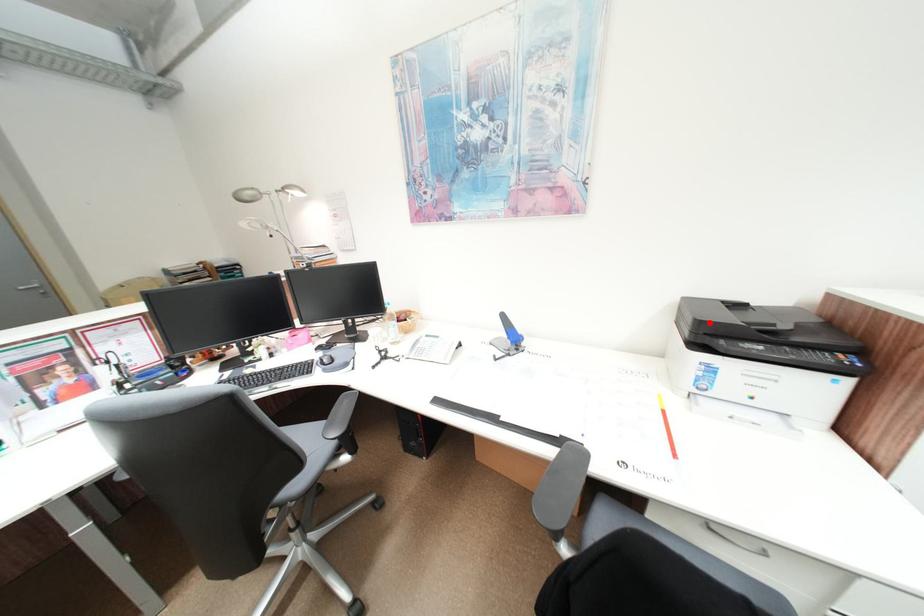
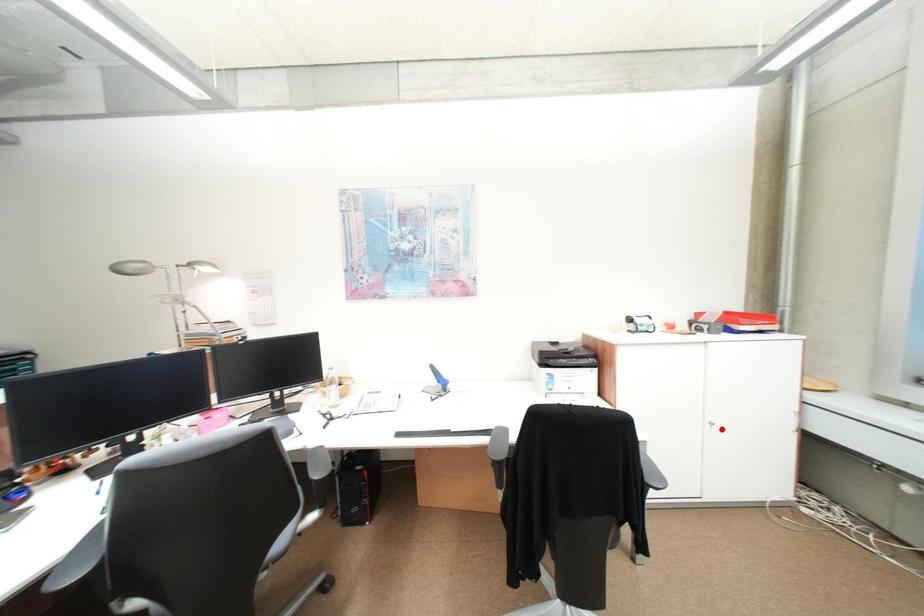
I am providing you with two images of the same scene from different viewpoints. A red point is marked on the first image and another point is marked on the second image. Is the red point in image1 aligned with the point shown in image2?

No